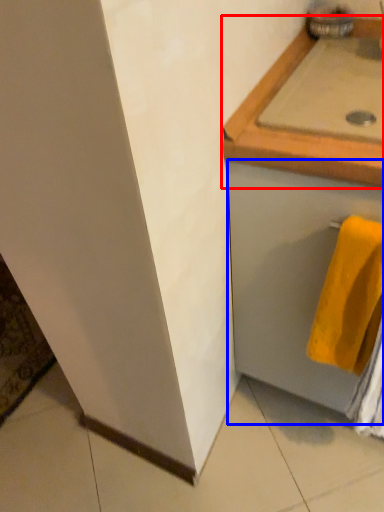
Question: Among these objects, which one is farthest to the camera, countertop (highlighted by a red box) or drawer (highlighted by a blue box)?

Choices:
 (A) countertop
 (B) drawer

Answer: (A)